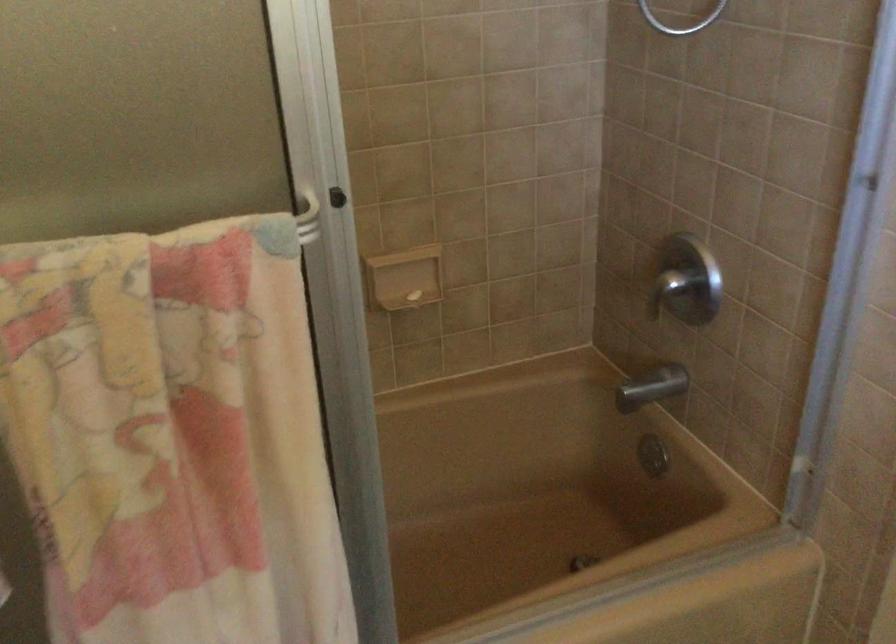
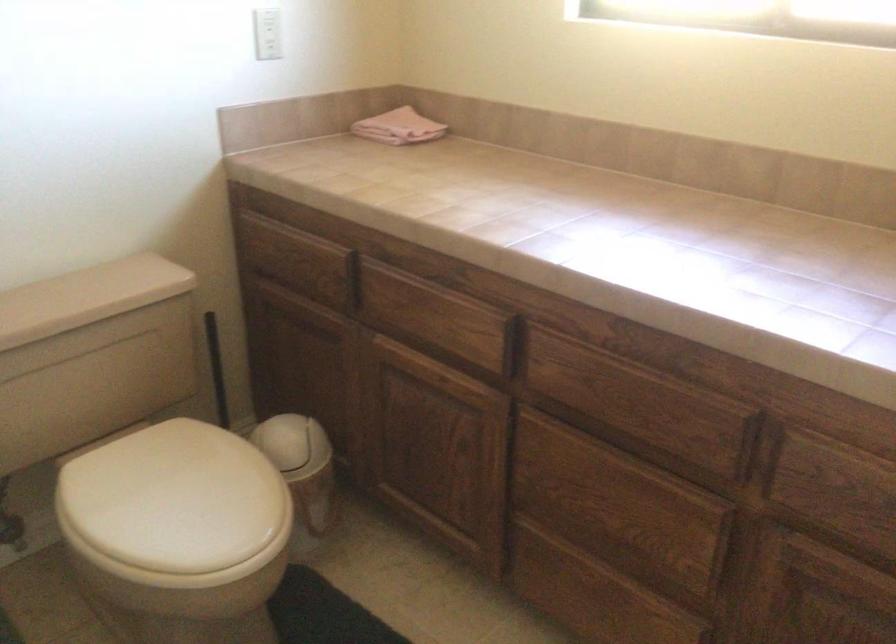
How did the camera likely rotate?

The rotation direction of the camera is right-down.